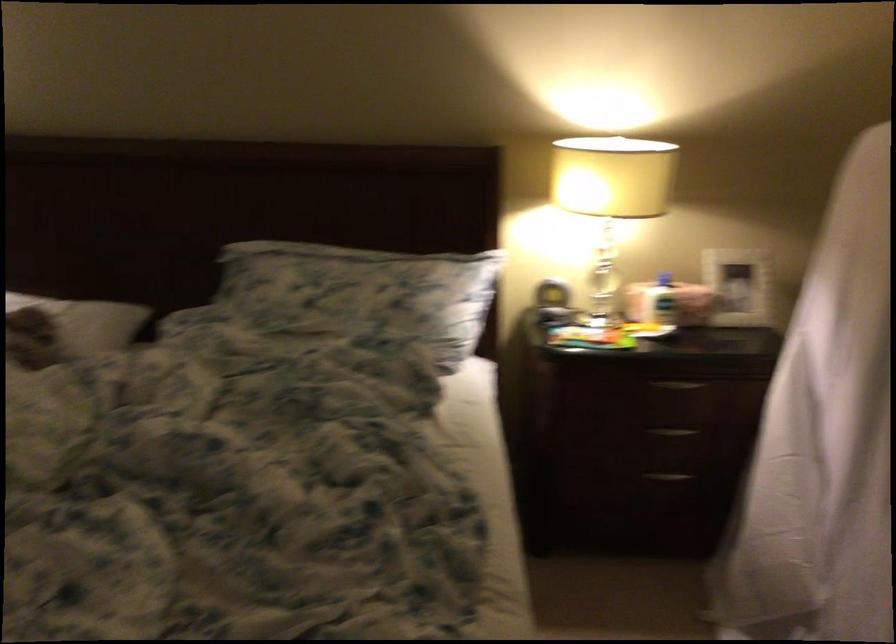
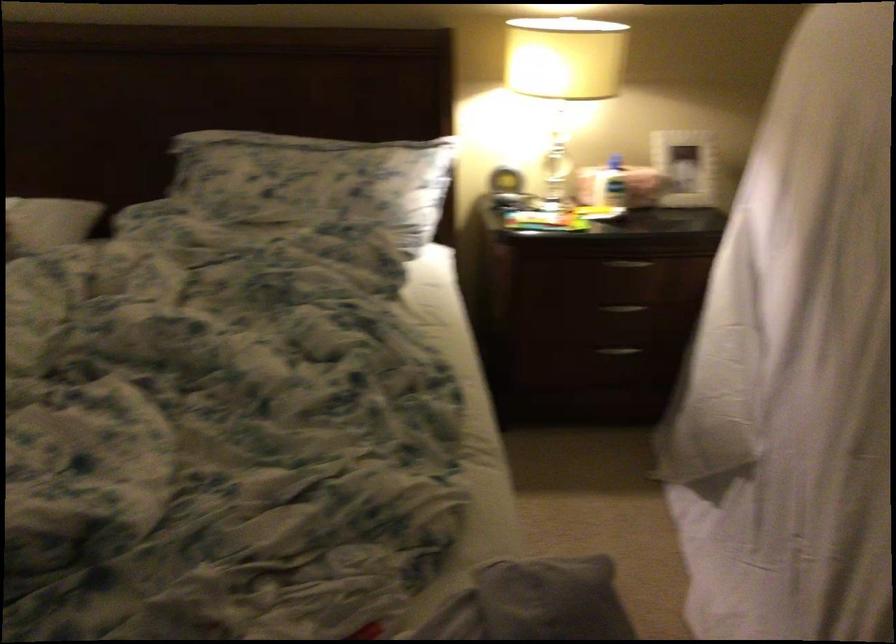
The point at (x=662, y=301) is marked in the first image. Where is the corresponding point in the second image?

(609, 184)